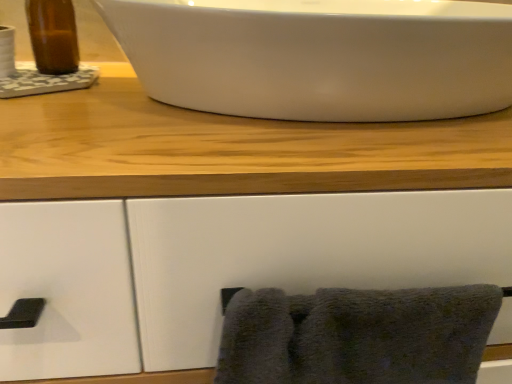
Identify the location of vacant region in front of brown glass bottle at upper left, the 1th sink when ordered from left to right. (70, 111).